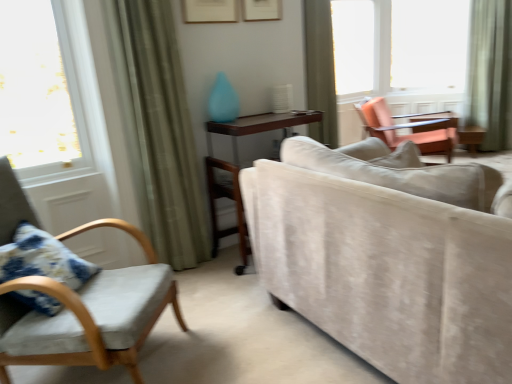
This screenshot has width=512, height=384. What are the coordinates of `free location in front of matte glass vase at upper center` in the screenshot? It's located at click(238, 124).